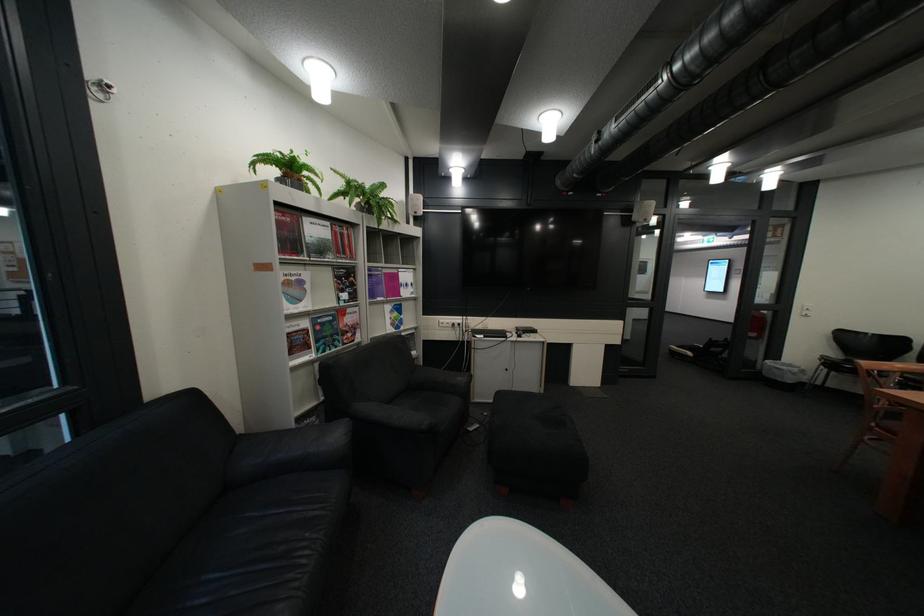
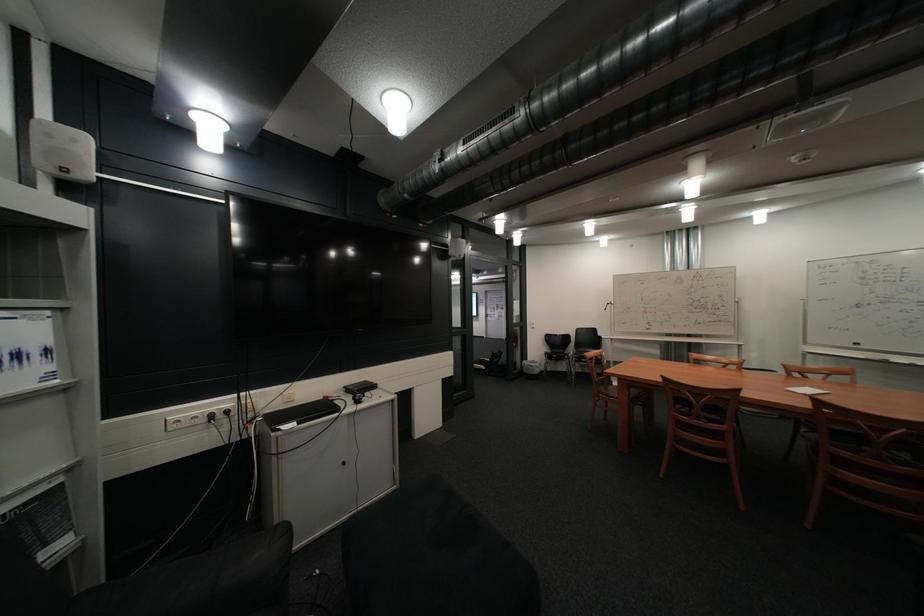
Question: The first image is from the beginning of the video and the second image is from the end. How did the camera likely rotate when shooting the video?

Choices:
 (A) Left
 (B) Right
 (C) Up
 (D) Down

Answer: (B)